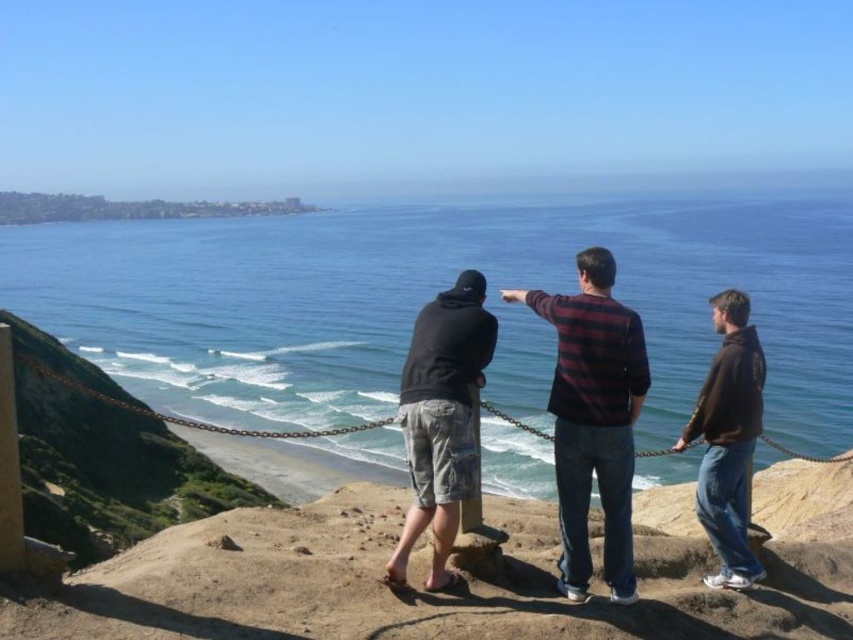
Question: Does blue water at center lie behind brown cotton hoodie at right?

Choices:
 (A) no
 (B) yes

Answer: (B)

Question: Which point appears closest to the camera in this image?

Choices:
 (A) (674, 636)
 (B) (555, 314)
 (C) (697, 429)

Answer: (A)

Question: Does striped sweater at center lie behind brown chain at center?

Choices:
 (A) yes
 (B) no

Answer: (A)

Question: Which point is closer to the camera?

Choices:
 (A) (708, 513)
 (B) (479, 356)

Answer: (B)

Question: Which point is closer to the camera?

Choices:
 (A) dark gray hoodie at center
 (B) brown chain at center
 (C) striped sweater at center
 (D) brown cotton hoodie at right

Answer: (B)

Question: Does blue water at center have a lesser width compared to sandy beach at lower center?

Choices:
 (A) yes
 (B) no

Answer: (B)